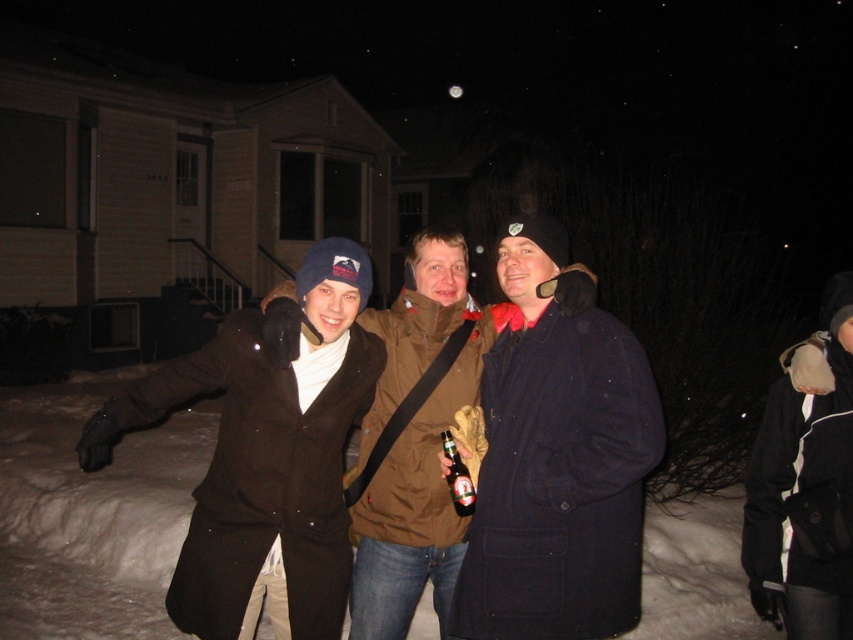
Can you confirm if matte brown coat at center is smaller than black fuzzy hat at upper right?

No, matte brown coat at center is not smaller than black fuzzy hat at upper right.

Does point (321, 291) lie behind point (780, 552)?

That is False.

Locate an element on the screen. The image size is (853, 640). matte brown coat at center is located at coordinates (267, 452).

Locate an element on the screen. matte brown coat at center is located at coordinates (267, 452).

The width and height of the screenshot is (853, 640). What do you see at coordinates (267, 452) in the screenshot? I see `matte brown coat at center` at bounding box center [267, 452].

Between matte brown coat at center and translucent glass bottle at center, which one appears on the right side from the viewer's perspective?

translucent glass bottle at center is more to the right.

Does point (302, 456) come in front of point (444, 449)?

Yes, point (302, 456) is in front of point (444, 449).

You are a GUI agent. You are given a task and a screenshot of the screen. Output one action in this format:
    pyautogui.click(x=<x>, y=<y>)
    Task: Click on the matte brown coat at center
    
    Given the screenshot: What is the action you would take?
    pyautogui.click(x=267, y=452)

Which of these two, brown woolen coat at center or translucent glass bottle at center, stands taller?

Standing taller between the two is brown woolen coat at center.

Which is above, brown woolen coat at center or translucent glass bottle at center?

translucent glass bottle at center is higher up.

The height and width of the screenshot is (640, 853). I want to click on brown woolen coat at center, so click(x=415, y=438).